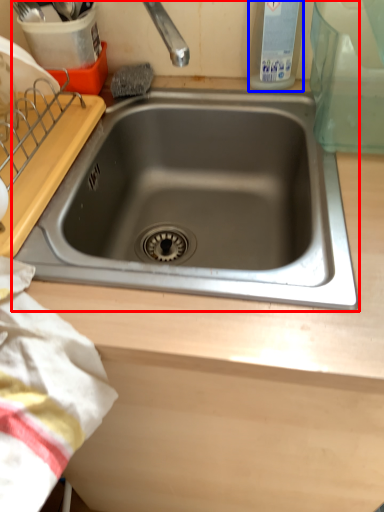
Question: Which of the following is the closest to the observer, sink (highlighted by a red box) or bottle (highlighted by a blue box)?

Choices:
 (A) sink
 (B) bottle

Answer: (A)